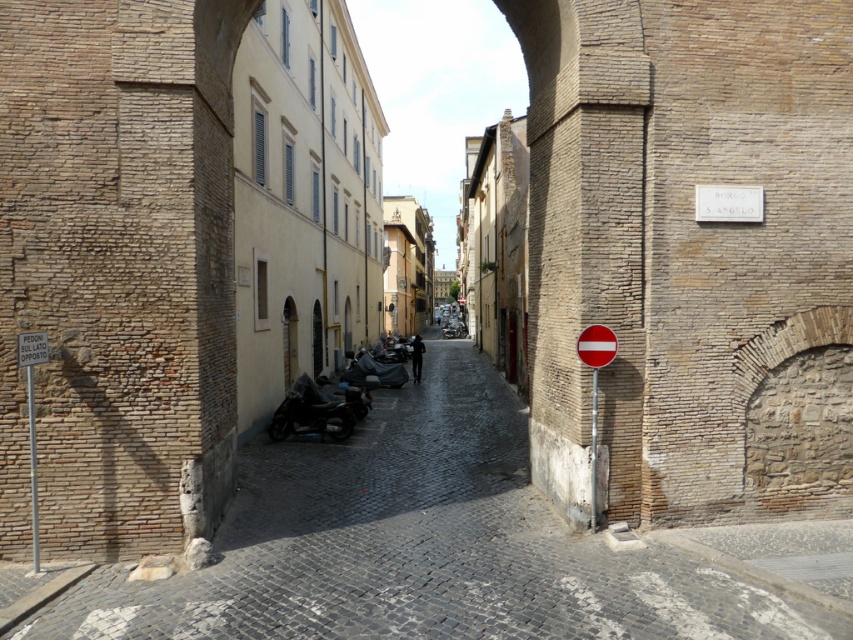
Question: Which is farther from the white plastic sign at left?

Choices:
 (A) red matte sign at right
 (B) brick cobblestone alley at center

Answer: (A)

Question: Is brick cobblestone alley at center further to camera compared to red matte sign at right?

Choices:
 (A) yes
 (B) no

Answer: (B)

Question: Is brick cobblestone alley at center below white plastic sign at left?

Choices:
 (A) yes
 (B) no

Answer: (A)

Question: Is brick cobblestone alley at center to the right of white plastic sign at left from the viewer's perspective?

Choices:
 (A) no
 (B) yes

Answer: (B)

Question: Estimate the real-world distances between objects in this image. Which object is farther from the red matte sign at right?

Choices:
 (A) white plastic sign at left
 (B) brick cobblestone alley at center

Answer: (A)

Question: Which of the following is the farthest from the observer?

Choices:
 (A) [474, 621]
 (B) [598, 365]

Answer: (B)